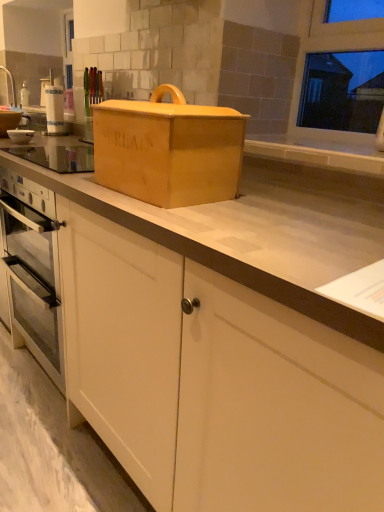
Locate an element on the screen. The width and height of the screenshot is (384, 512). white glossy bowl at left is located at coordinates (20, 135).

You are a GUI agent. You are given a task and a screenshot of the screen. Output one action in this format:
    pyautogui.click(x=<x>, y=<y>)
    Task: Click on the white glossy sink at upper left
    This screenshot has height=512, width=384.
    Given the screenshot: What is the action you would take?
    pyautogui.click(x=10, y=110)

Locate an element on the screen. matte wooden bread box at center is located at coordinates (168, 149).

Locate an element on the screen. white glossy bowl at left is located at coordinates 20,135.

Is white glossy bowl at left to the right of white matte cabinet at lower center from the viewer's perspective?

Indeed, white glossy bowl at left is positioned on the right side of white matte cabinet at lower center.

From a real-world perspective, is white glossy bowl at left physically located above or below white matte cabinet at lower center?

Clearly, from a real-world perspective, white glossy bowl at left is above white matte cabinet at lower center.

Considering the sizes of objects white glossy bowl at left and white matte cabinet at lower center in the image provided, who is shorter, white glossy bowl at left or white matte cabinet at lower center?

With less height is white matte cabinet at lower center.

Considering the relative positions of white glossy bowl at left and white matte cabinet at lower center in the image provided, is white glossy bowl at left in front of white matte cabinet at lower center?

No, it is not.

Is white glossy bowl at left thinner than matte wooden bread box at center?

Correct, the width of white glossy bowl at left is less than that of matte wooden bread box at center.

Measure the distance from white glossy bowl at left to matte wooden bread box at center.

white glossy bowl at left is 1.15 meters away from matte wooden bread box at center.

Between white glossy bowl at left and matte wooden bread box at center, which one has smaller size?

white glossy bowl at left.

Considering the positions of objects white glossy bowl at left and matte wooden bread box at center in the image provided, who is behind, white glossy bowl at left or matte wooden bread box at center?

Positioned behind is white glossy bowl at left.

From the image's perspective, does white matte cabinet at lower center appear higher than white glossy bowl at left?

No, from the image's perspective, white matte cabinet at lower center is not on top of white glossy bowl at left.

Can you confirm if white matte cabinet at lower center is thinner than white glossy bowl at left?

No.

Is white matte cabinet at lower center spatially inside white glossy bowl at left, or outside of it?

The correct answer is: outside.

From the picture: Which of these two, white matte cabinet at lower center or white glossy bowl at left, stands taller?

white glossy bowl at left is taller.

From the image's perspective, is matte wooden bread box at center over white glossy sink at upper left?

No, from the image's perspective, matte wooden bread box at center is not above white glossy sink at upper left.

Does matte wooden bread box at center appear on the left side of white glossy sink at upper left?

Incorrect, matte wooden bread box at center is not on the left side of white glossy sink at upper left.

Is matte wooden bread box at center looking in the opposite direction of white glossy sink at upper left?

No, white glossy sink at upper left is not at the back of matte wooden bread box at center.

Which of these two, matte wooden bread box at center or white glossy sink at upper left, is smaller?

white glossy sink at upper left is smaller.

Looking at this image, is the surface of white glossy sink at upper left in direct contact with white matte cabinet at lower center?

No, white glossy sink at upper left is not with white matte cabinet at lower center.

Between white glossy sink at upper left and white matte cabinet at lower center, which one has less height?

With less height is white matte cabinet at lower center.

Is white glossy sink at upper left inside the boundaries of white matte cabinet at lower center, or outside?

white glossy sink at upper left is not inside white matte cabinet at lower center, it's outside.

Which is in front, matte wooden bread box at center or white glossy bowl at left?

matte wooden bread box at center is more forward.

From the picture: Is matte wooden bread box at center oriented away from white glossy bowl at left?

No, white glossy bowl at left is not at the back of matte wooden bread box at center.

Are matte wooden bread box at center and white glossy bowl at left far apart?

Yes, matte wooden bread box at center is far from white glossy bowl at left.

What's the angular difference between matte wooden bread box at center and white matte cabinet at lower center's facing directions?

88.4 degrees.

Is matte wooden bread box at center bigger than white matte cabinet at lower center?

No.

From a real-world perspective, between matte wooden bread box at center and white matte cabinet at lower center, who is vertically lower?

white matte cabinet at lower center is physically lower.

Considering the positions of objects matte wooden bread box at center and white matte cabinet at lower center in the image provided, who is more to the left, matte wooden bread box at center or white matte cabinet at lower center?

white matte cabinet at lower center is more to the left.

Identify the location of cabinetry below the white glossy bowl at left (from a real-world perspective). (214, 381).

In the image, there is a matte wooden bread box at center. What are the coordinates of `appliance above it (from the image's perspective)` in the screenshot? It's located at (20, 135).

Considering their positions, is white matte cabinet at lower center positioned closer to matte wooden bread box at center than white glossy bowl at left?

white matte cabinet at lower center is closer to matte wooden bread box at center.

When comparing their distances from white matte cabinet at lower center, does matte wooden bread box at center or white glossy sink at upper left seem further?

white glossy sink at upper left.

Looking at this image, looking at the image, which one is located further to white matte cabinet at lower center, white glossy bowl at left or matte wooden bread box at center?

white glossy bowl at left is positioned further to the anchor white matte cabinet at lower center.

Based on their spatial positions, is white matte cabinet at lower center or matte wooden bread box at center closer to white glossy sink at upper left?

matte wooden bread box at center is closer to white glossy sink at upper left.

Which object lies nearer to the anchor point white glossy sink at upper left, matte wooden bread box at center or white glossy bowl at left?

The object closer to white glossy sink at upper left is white glossy bowl at left.

Looking at the image, which one is located closer to white glossy bowl at left, matte wooden bread box at center or white glossy sink at upper left?

white glossy sink at upper left is positioned closer to the anchor white glossy bowl at left.

When comparing their distances from white glossy bowl at left, does white matte cabinet at lower center or white glossy sink at upper left seem closer?

white glossy sink at upper left is closer to white glossy bowl at left.

Considering their positions, is matte wooden bread box at center positioned closer to white glossy bowl at left than white matte cabinet at lower center?

matte wooden bread box at center.

Locate an element on the screen. The image size is (384, 512). appliance between matte wooden bread box at center and white glossy sink at upper left from front to back is located at coordinates (20, 135).

Identify the location of cabinetry positioned between matte wooden bread box at center and white glossy sink at upper left from near to far. The height and width of the screenshot is (512, 384). (214, 381).

Identify the location of appliance between white matte cabinet at lower center and white glossy sink at upper left in the front-back direction. (20, 135).

What are the coordinates of `cabinetry positioned between matte wooden bread box at center and white glossy bowl at left from near to far` in the screenshot? It's located at (214, 381).